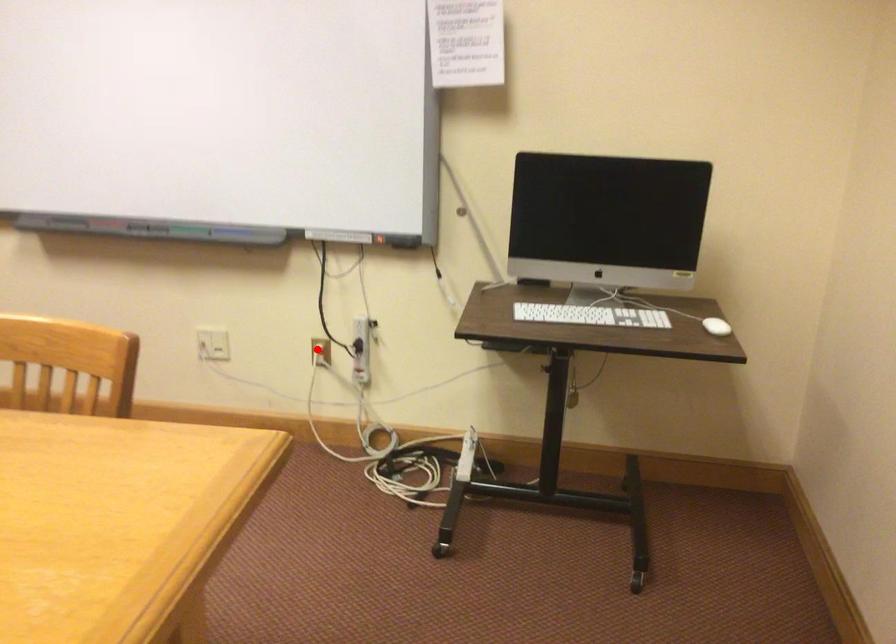
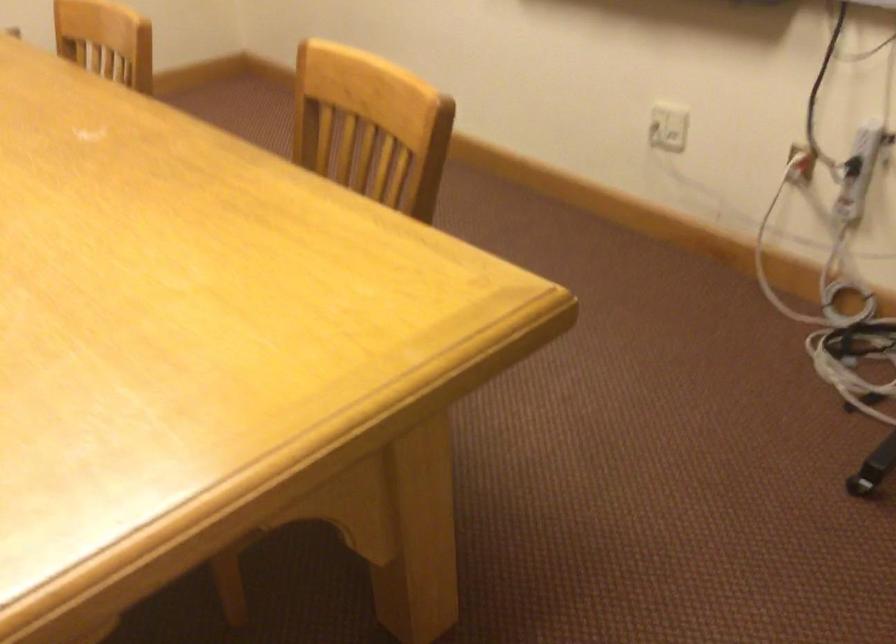
Question: I am providing you with two images of the same scene from different viewpoints. In image1, a red point is highlighted. Considering the same 3D point in image2, which of the following is correct?

Choices:
 (A) It is closer
 (B) It is farther

Answer: (A)